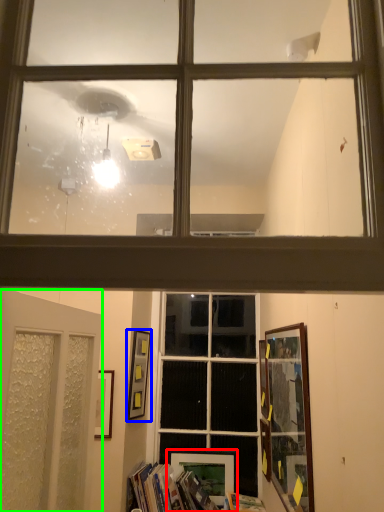
Question: Which is farther away from picture frame (highlighted by a red box)? picture frame (highlighted by a blue box) or door (highlighted by a green box)?

Choices:
 (A) picture frame
 (B) door

Answer: (B)